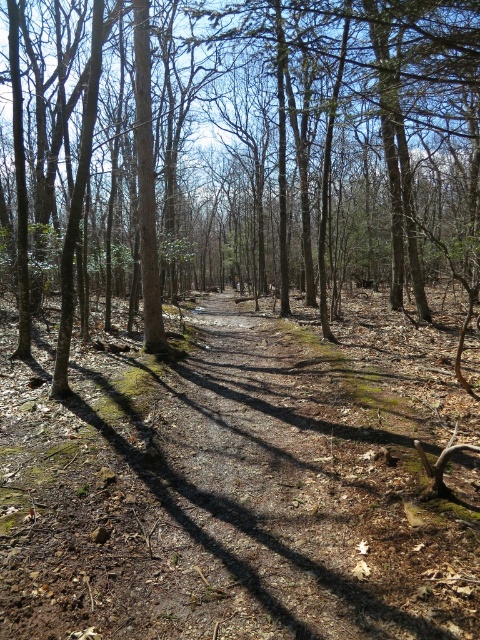
You are a hiker carrying a heavy backpack and need to rest. You see the brown dirt track at center and the brown bark tree at center. Which one is closer to you?

The brown dirt track at center is 28.81 feet away from brown bark tree at center. Since the question asks which is closer, but the distance between them is given, but the hiker is on the path, so the dirt track is underfoot, so the dirt track is closer. But according to the description, the distance between the two objects is 28.81 feet. However, the hiker is likely on the path, so the dirt track is right where they are, making it closer than the tree. But the description only states their separation, not h

You are a hiker carrying a heavy backpack and need to walk along the brown dirt track at center. There is a brown bark tree at center blocking your path. Can you walk around it without leaving the track?

The brown dirt track at center is in front of the brown bark tree at center, meaning the tree is behind the track. You can continue walking along the track without needing to go around the tree since it is not obstructing your path.

You are standing at the center of the forest path and want to reach both point (252, 566) and point (264, 248). Which point is closer to you?

Point (252, 566) is closer to the viewer than point (264, 248), so you should reach point (252, 566) first.